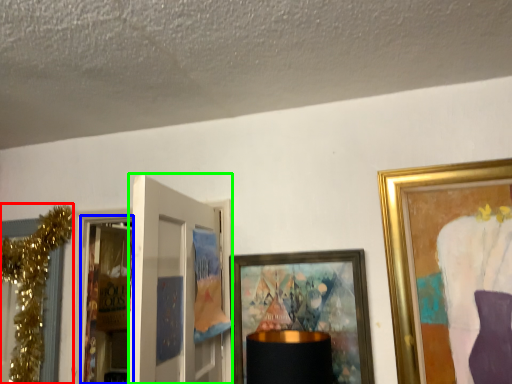
Question: Based on their relative distances, which object is farther from christmas decoration (highlighted by a red box)? Choose from screen door (highlighted by a blue box) and door (highlighted by a green box).

Choices:
 (A) screen door
 (B) door

Answer: (A)